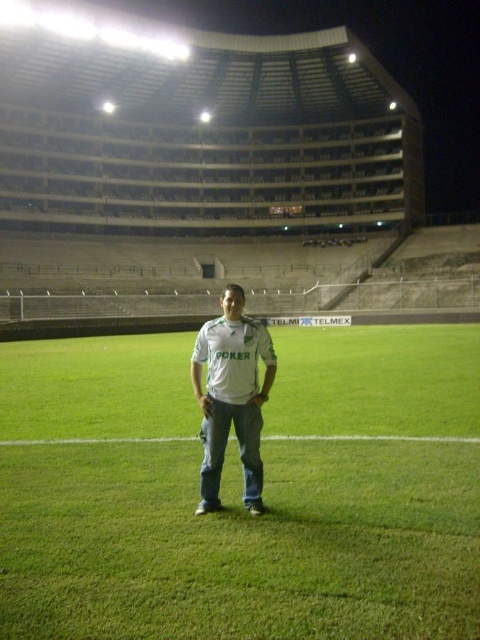
Question: In this image, where is green grass at center located relative to white matte shirt at center?

Choices:
 (A) left
 (B) right

Answer: (A)

Question: Which point is farther to the camera?

Choices:
 (A) (326, 380)
 (B) (259, 486)

Answer: (A)

Question: Can you confirm if green grass at center is bigger than white matte shirt at center?

Choices:
 (A) yes
 (B) no

Answer: (A)

Question: Does green grass at center appear on the right side of white matte shirt at center?

Choices:
 (A) yes
 (B) no

Answer: (B)